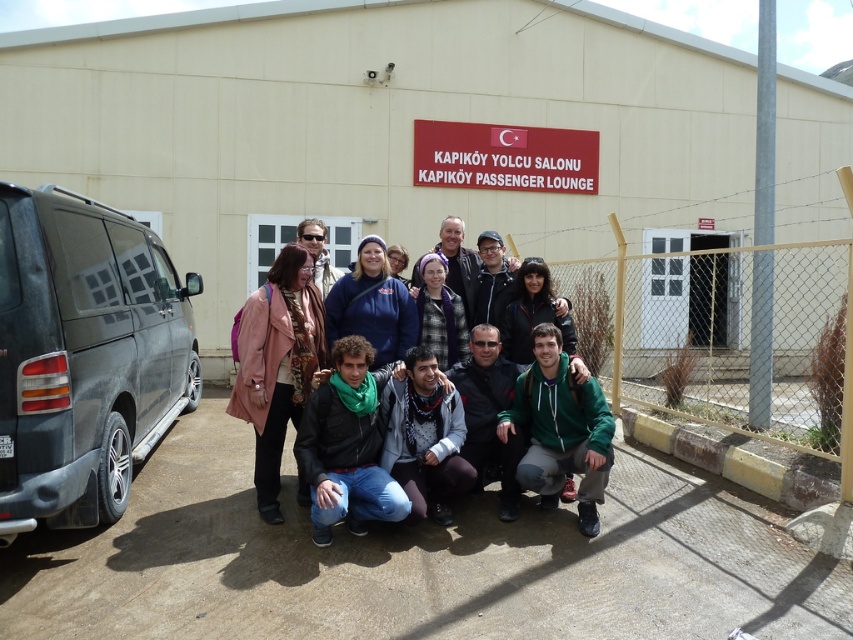
Does point (374, 324) come closer to viewer compared to point (427, 262)?

Yes, point (374, 324) is closer to viewer.

From the picture: Which of these two, blue fleece jacket at center or purple fuzzy hat at center, stands shorter?

With less height is purple fuzzy hat at center.

Is point (379, 332) positioned after point (440, 269)?

No.

The height and width of the screenshot is (640, 853). Identify the location of blue fleece jacket at center. (372, 305).

Who is taller, green fleece jacket at center or matte black jacket at center?

green fleece jacket at center

Is green fleece jacket at center wider than matte black jacket at center?

Correct, the width of green fleece jacket at center exceeds that of matte black jacket at center.

Which is in front, point (297, 400) or point (538, 289)?

Point (297, 400) is in front.

Where is `green fleece jacket at center`? This screenshot has height=640, width=853. green fleece jacket at center is located at coordinates (280, 360).

Who is taller, green scarf at center or green fleece jacket at lower center?

Standing taller between the two is green fleece jacket at lower center.

Can you confirm if green scarf at center is positioned to the left of green fleece jacket at lower center?

Correct, you'll find green scarf at center to the left of green fleece jacket at lower center.

Is point (347, 381) positioned after point (556, 364)?

No.

You are a GUI agent. You are given a task and a screenshot of the screen. Output one action in this format:
    pyautogui.click(x=<x>, y=<y>)
    Task: Click on the green scarf at center
    The image size is (853, 640).
    Given the screenshot: What is the action you would take?
    pyautogui.click(x=347, y=444)